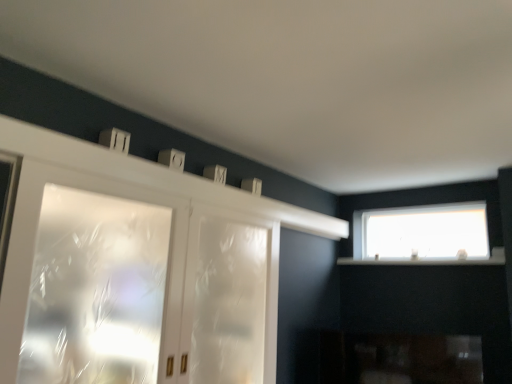
Question: From their relative heights in the image, would you say frosted glass cabinet at left, which appears as the 1th window when viewed from the left, is taller or shorter than white matte mantle at upper center?

Choices:
 (A) tall
 (B) short

Answer: (A)

Question: Based on their sizes in the image, would you say frosted glass cabinet at left, which appears as the first window when viewed from the front, is bigger or smaller than white matte mantle at upper center?

Choices:
 (A) big
 (B) small

Answer: (A)

Question: Which of these objects is positioned closest to the white matte mantle at upper center?

Choices:
 (A) transparent plastic screen door at center
 (B) transparent glass window at upper right, which is the 1th window from back to front
 (C) frosted glass cabinet at left, acting as the second window starting from the back

Answer: (A)

Question: Which is nearer to the transparent glass window at upper right, the second window positioned from the left?

Choices:
 (A) white matte mantle at upper center
 (B) transparent plastic screen door at center
 (C) frosted glass cabinet at left, which appears as the first window when viewed from the front

Answer: (A)